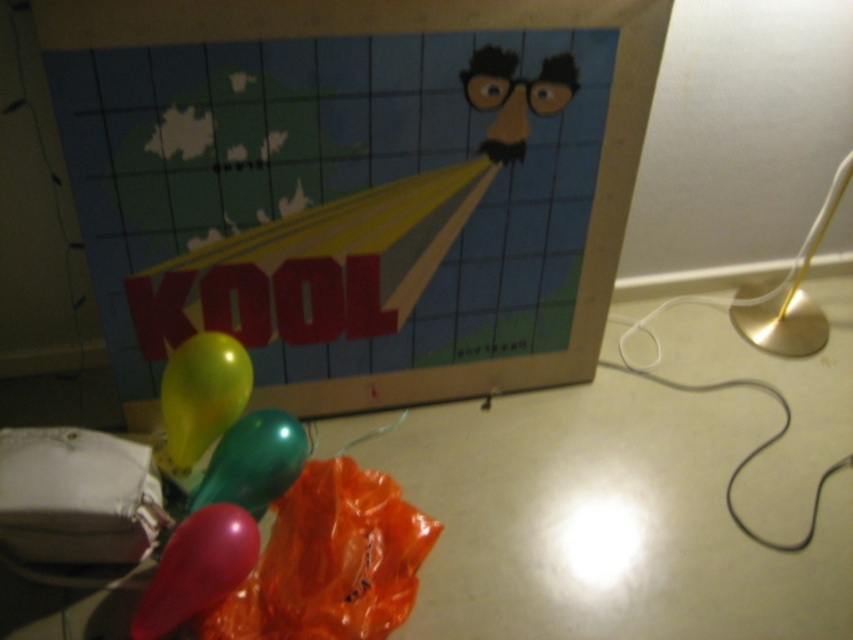
Does point (752, 577) come closer to viewer compared to point (219, 509)?

No, it is not.

Is matte plastic balloons at lower left shorter than rubber balloon at lower left?

No.

Find the location of a particular element. The height and width of the screenshot is (640, 853). matte plastic balloons at lower left is located at coordinates (607, 518).

You are a GUI agent. You are given a task and a screenshot of the screen. Output one action in this format:
    pyautogui.click(x=<x>, y=<y>)
    Task: Click on the matte plastic balloons at lower left
    This screenshot has width=853, height=640.
    Given the screenshot: What is the action you would take?
    pyautogui.click(x=607, y=518)

Which is behind, point (138, 632) or point (796, 316)?

Point (796, 316)

Is point (222, 586) closer to camera compared to point (821, 314)?

Yes.

Image resolution: width=853 pixels, height=640 pixels. In order to click on rubber balloon at lower left in this screenshot , I will do `click(196, 568)`.

Is rubber balloon at lower left below shiny metallic balloon at center?

Yes, rubber balloon at lower left is below shiny metallic balloon at center.

Which of these two, rubber balloon at lower left or shiny metallic balloon at center, stands shorter?

Standing shorter between the two is rubber balloon at lower left.

You are a GUI agent. You are given a task and a screenshot of the screen. Output one action in this format:
    pyautogui.click(x=<x>, y=<y>)
    Task: Click on the rubber balloon at lower left
    The width and height of the screenshot is (853, 640).
    Given the screenshot: What is the action you would take?
    pyautogui.click(x=196, y=568)